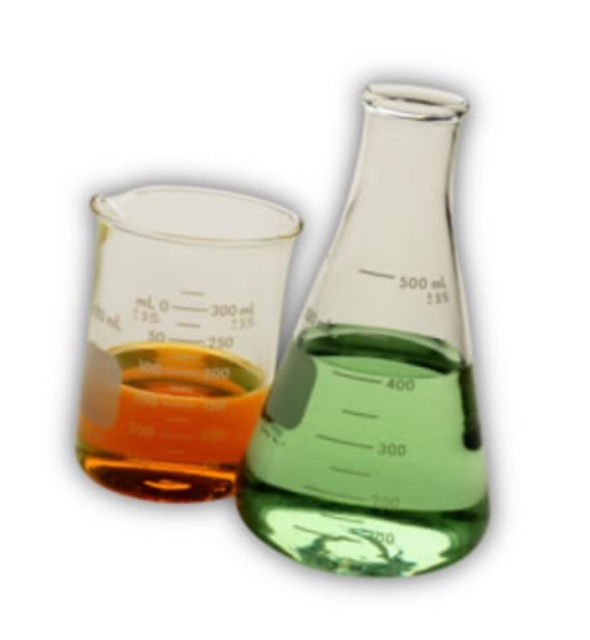
Question: Which of the following is the farthest from the observer?

Choices:
 (A) translucent glass beaker at left
 (B) transparent glass beaker at center

Answer: (A)

Question: Does transparent glass beaker at center appear over translucent glass beaker at left?

Choices:
 (A) yes
 (B) no

Answer: (B)

Question: Does transparent glass beaker at center have a greater width compared to translucent glass beaker at left?

Choices:
 (A) no
 (B) yes

Answer: (B)

Question: Is transparent glass beaker at center below translucent glass beaker at left?

Choices:
 (A) yes
 (B) no

Answer: (A)

Question: Which of the following is the closest to the observer?

Choices:
 (A) (391, 289)
 (B) (253, 346)

Answer: (A)